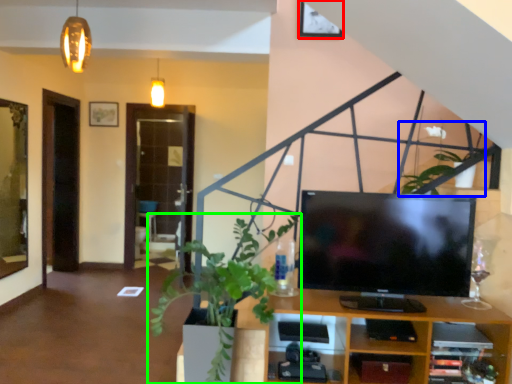
Question: Considering the real-world distances, which object is farthest from picture frame (highlighted by a red box)? plant (highlighted by a blue box) or houseplant (highlighted by a green box)?

Choices:
 (A) plant
 (B) houseplant

Answer: (B)